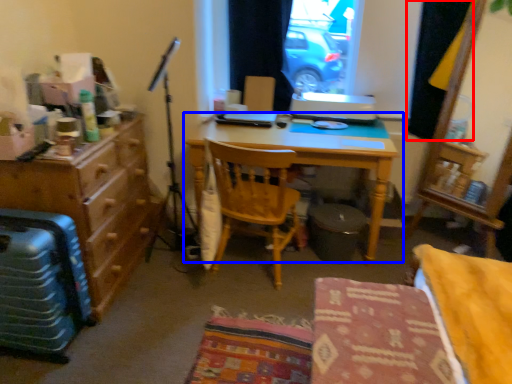
Question: Which object is further to the camera taking this photo, curtain (highlighted by a red box) or desk (highlighted by a blue box)?

Choices:
 (A) curtain
 (B) desk

Answer: (A)